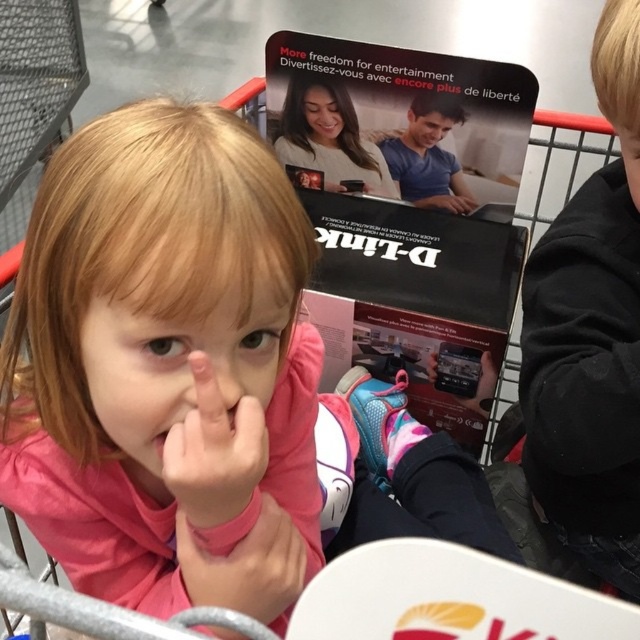
Who is taller, black cotton hoodie at upper right or smooth skin girl at center?

With more height is black cotton hoodie at upper right.

Which is in front, point (600, 86) or point (316, 161)?

Positioned in front is point (600, 86).

Who is more distant from viewer, (611, 13) or (307, 97)?

Point (307, 97)

Where is `black cotton hoodie at upper right`? The height and width of the screenshot is (640, 640). black cotton hoodie at upper right is located at coordinates (589, 336).

Is pink fleece jacket at upper left positioned at the back of smooth skin girl at center?

No, it is in front of smooth skin girl at center.

Between pink fleece jacket at upper left and smooth skin girl at center, which one is positioned lower?

pink fleece jacket at upper left

Locate an element on the screen. pink fleece jacket at upper left is located at coordinates (173, 372).

Can you confirm if black cotton hoodie at upper right is taller than pink matte hand at center?

Indeed, black cotton hoodie at upper right has a greater height compared to pink matte hand at center.

This screenshot has height=640, width=640. I want to click on black cotton hoodie at upper right, so click(589, 336).